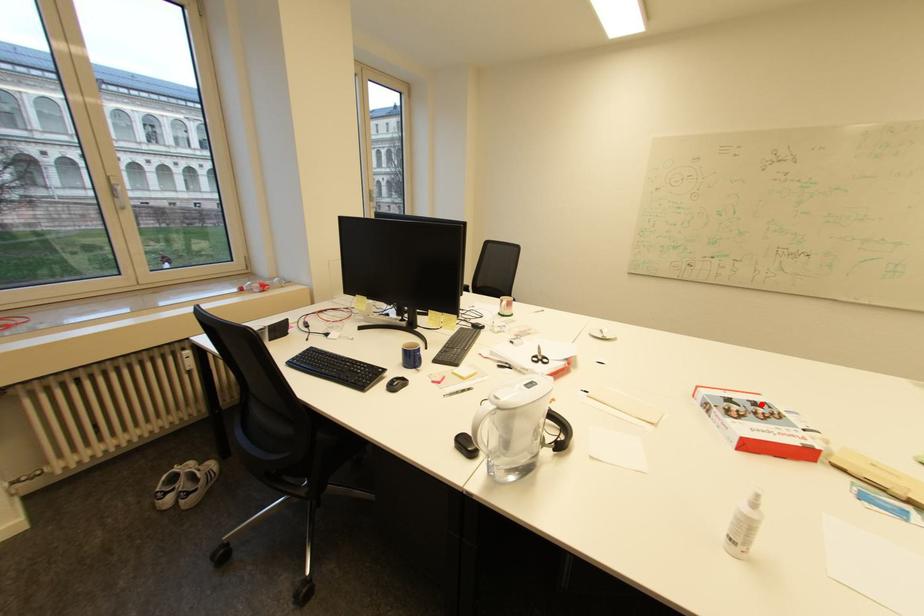
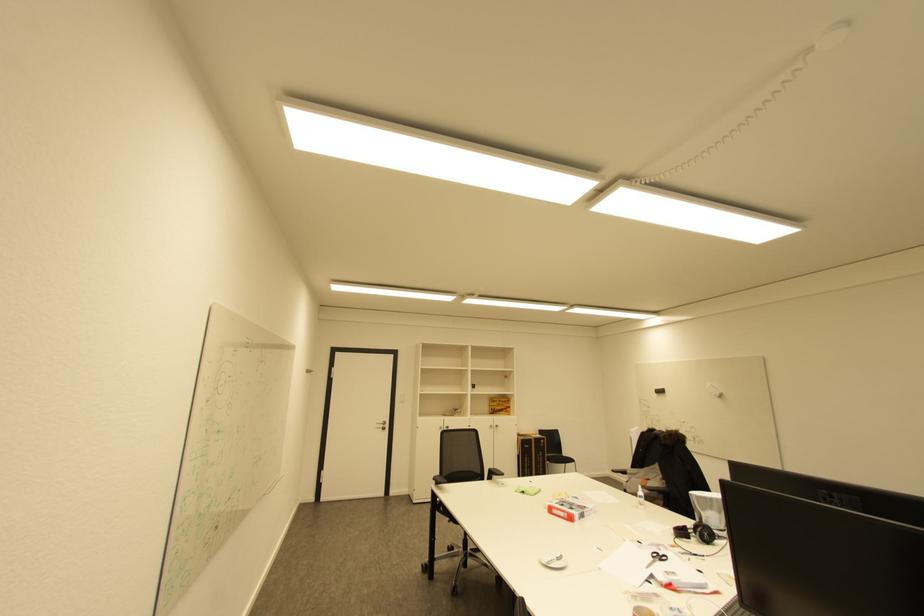
Question: I am providing you with two images of the same scene from different viewpoints. In image1, a red point is highlighted. Considering the same 3D point in image2, which of the following is correct?

Choices:
 (A) It is closer
 (B) It is farther

Answer: (A)